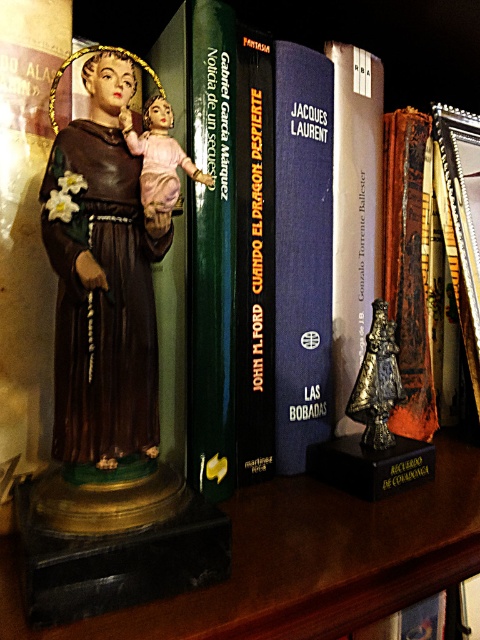
You are an interior designer arranging items on a shelf. You have two bells, a silver metallic bell at center and a shiny bronze bell at center. You want to place them side by side so that the wider one is on the left. Which bell should you place on the left?

The silver metallic bell at center might be wider than the shiny bronze bell at center, so you should place the silver metallic bell at center on the left to ensure the wider one is on the left.

You are organizing a shelf and need to place the blue hardcover book at center and the porcelain doll at center. Based on their positions, which item is on the left side of the shelf?

The porcelain doll at center is on the left side of the shelf because the blue hardcover book at center is to its right.